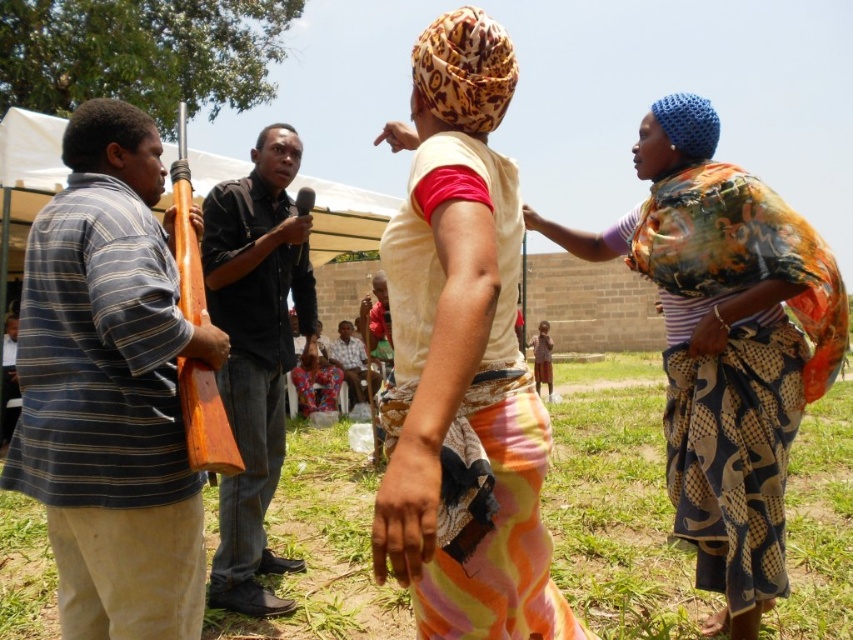
Between multicolored woven cloth at right and red fabric shirt at center, which one is positioned lower?

multicolored woven cloth at right

Which is behind, point (677, 166) or point (361, 328)?

Point (361, 328)

Where is `multicolored woven cloth at right`? The image size is (853, 640). multicolored woven cloth at right is located at coordinates (724, 344).

Does dirt field at lower center appear on the right side of black shirt at center?

Indeed, dirt field at lower center is positioned on the right side of black shirt at center.

Can you confirm if dirt field at lower center is taller than black shirt at center?

In fact, dirt field at lower center may be shorter than black shirt at center.

Between point (39, 564) and point (234, 518), which one is positioned in front?

Point (234, 518)

At what (x,y) coordinates should I click in order to perform the action: click on dirt field at lower center. Please return your answer as a coordinate pair (x, y). The image size is (853, 640). Looking at the image, I should click on (618, 504).

Is matte yellow shirt at center to the right of white cotton shirt at center from the viewer's perspective?

Correct, you'll find matte yellow shirt at center to the right of white cotton shirt at center.

Is matte yellow shirt at center positioned in front of white cotton shirt at center?

That is True.

Is point (508, 337) positioned before point (361, 349)?

Yes, it is in front of point (361, 349).

Find the location of a particular element. This screenshot has width=853, height=640. matte yellow shirt at center is located at coordinates (462, 362).